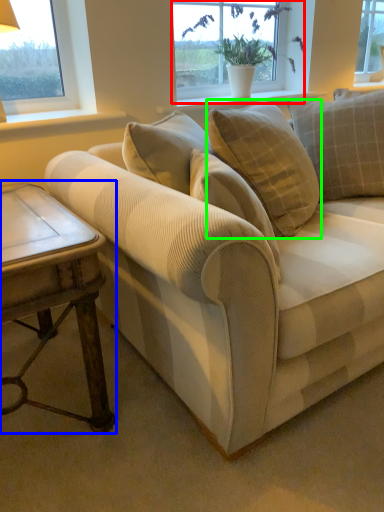
Question: Estimate the real-world distances between objects in this image. Which object is closer to window (highlighted by a red box), table (highlighted by a blue box) or pillow (highlighted by a green box)?

Choices:
 (A) table
 (B) pillow

Answer: (B)